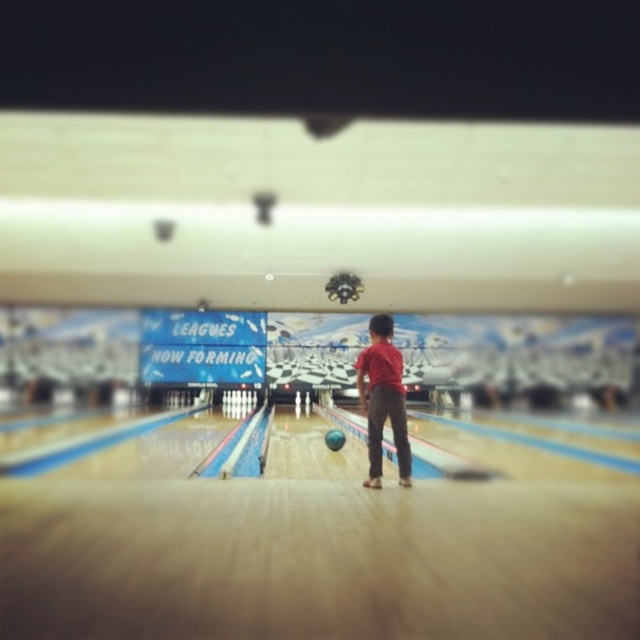
Looking at this image, you are a photographer standing at the side of the bowling lane. You need to capture a photo where both the red matte shirt at center and the shiny blue bowling ball at center are visible. Based on their positions, which object should appear higher in the photo?

The red matte shirt at center appears higher in the photo because it is positioned above the shiny blue bowling ball at center.

From the picture: You are a photographer standing at the back of the bowling alley. You want to take a photo of the red matte shirt at center and the shiny blue bowling ball at center. Which object appears taller in the photo?

The red matte shirt at center appears taller in the photo because it has a greater height compared to the shiny blue bowling ball at center.